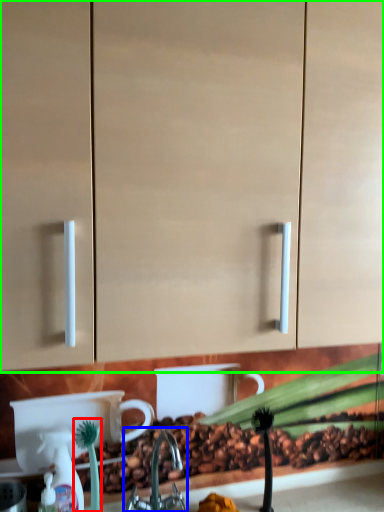
Question: Which object is positioned farthest from plant (highlighted by a red box)? Select from tap (highlighted by a blue box) and cabinetry (highlighted by a green box).

Choices:
 (A) tap
 (B) cabinetry

Answer: (B)